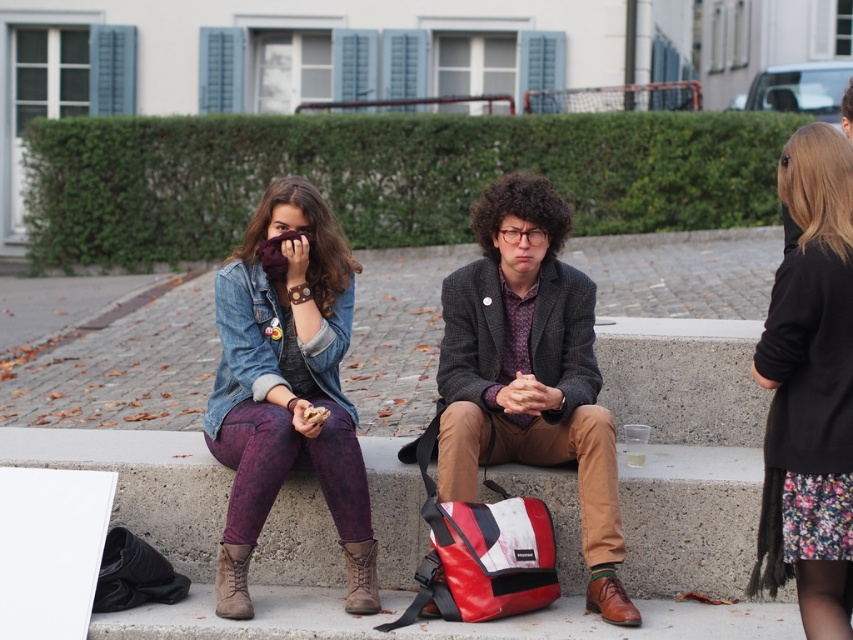
Question: Among these objects, which one is farthest from the camera?

Choices:
 (A) floral dress at right
 (B) brown leather boot at lower center

Answer: (B)

Question: Which object is closer to the camera taking this photo?

Choices:
 (A) brown leather boot at lower center
 (B) floral dress at right

Answer: (B)

Question: From the image, what is the correct spatial relationship of denim jacket at left in relation to floral dress at right?

Choices:
 (A) below
 (B) above

Answer: (B)

Question: From the image, what is the correct spatial relationship of denim jacket at left in relation to brown leather boot at lower left?

Choices:
 (A) above
 (B) below

Answer: (A)

Question: Does floral dress at right appear under brown leather boot at lower center?

Choices:
 (A) no
 (B) yes

Answer: (A)

Question: Estimate the real-world distances between objects in this image. Which object is closer to the denim jacket at left?

Choices:
 (A) textured wool blazer at center
 (B) floral dress at right
 (C) brown leather boot at lower center

Answer: (C)